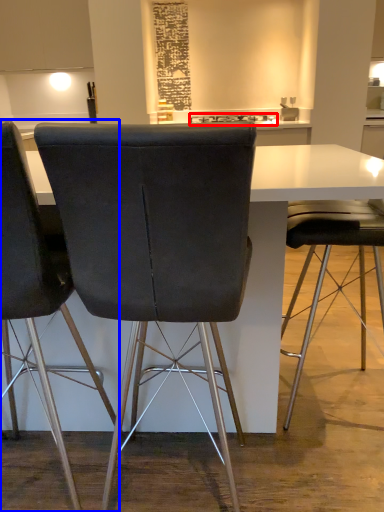
Question: Which object appears closest to the camera in this image, appliance (highlighted by a red box) or chair (highlighted by a blue box)?

Choices:
 (A) appliance
 (B) chair

Answer: (B)